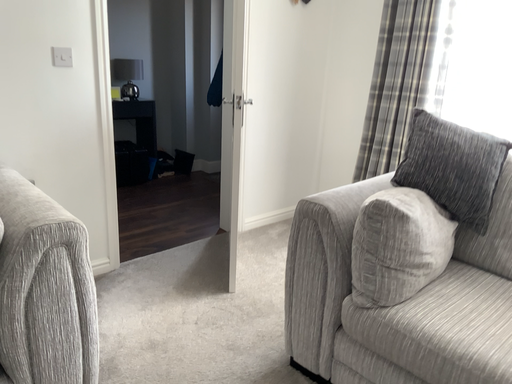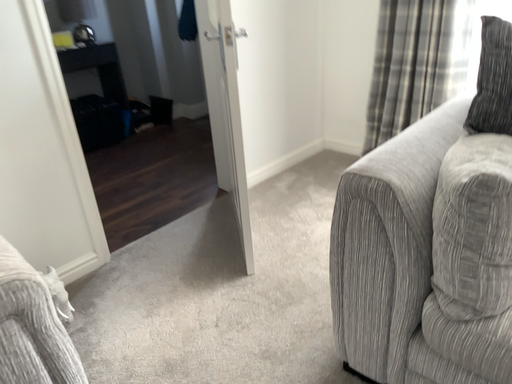
Question: Which way did the camera rotate in the video?

Choices:
 (A) rotated upward
 (B) rotated downward

Answer: (B)